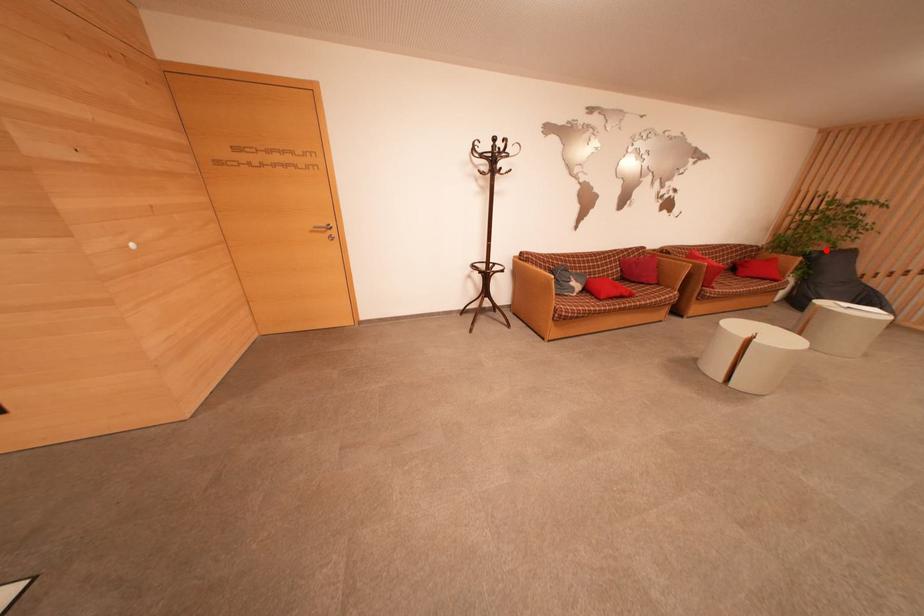
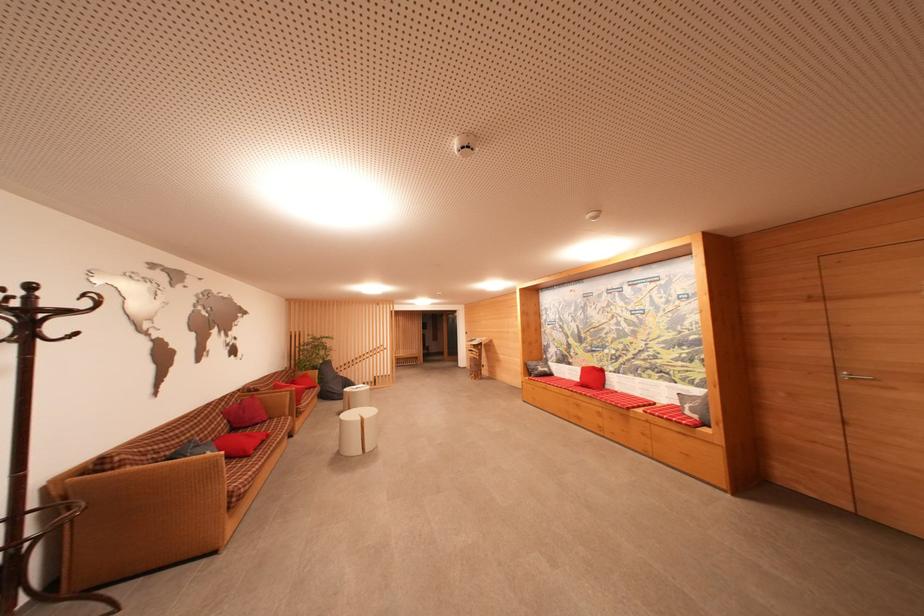
The point at the highlighted location is marked in the first image. Where is the corresponding point in the second image?

(323, 365)